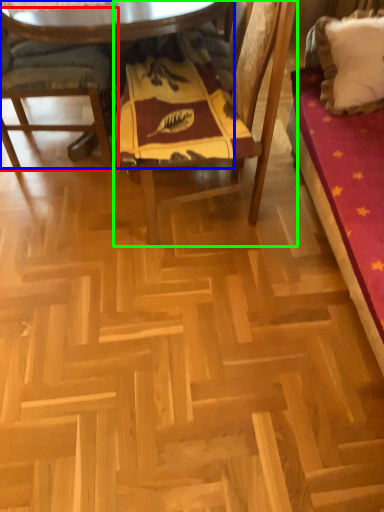
Question: Considering the real-world distances, which object is closest to chair (highlighted by a red box)? table (highlighted by a blue box) or chair (highlighted by a green box).

Choices:
 (A) table
 (B) chair

Answer: (A)